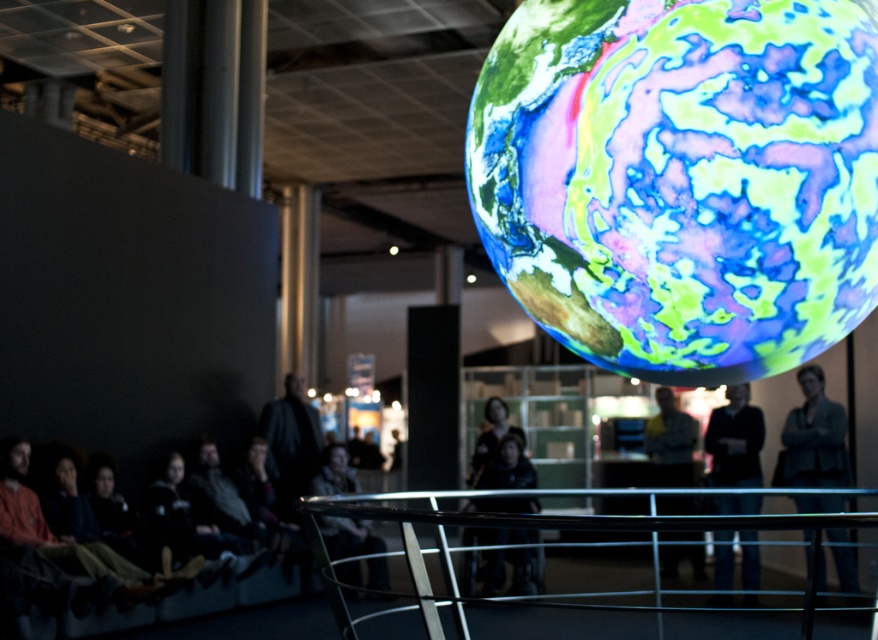
You are standing in the room and want to place a 16 feet long ladder between the translucent glass globe at upper center and the matte gray jacket at right. Can the ladder fit between them without overlapping either object?

The distance between the translucent glass globe at upper center and the matte gray jacket at right is 18.13 feet. Since the ladder is 16 feet long, it can fit between them without overlapping either object because 16 feet is shorter than 18.13 feet.

Based on the photo, you are trying to decide which jacket to take for a cold day. You have the matte gray jacket at right and the light brown leather jacket at center. According to the scene, which jacket might be warmer based on its thickness?

The light brown leather jacket at center is thicker than the matte gray jacket at right, so it might be warmer.